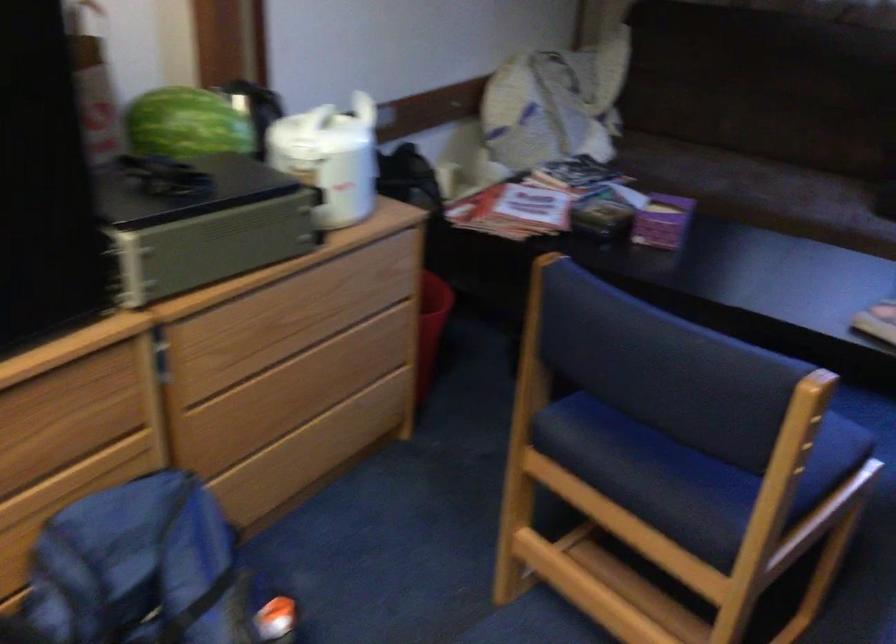
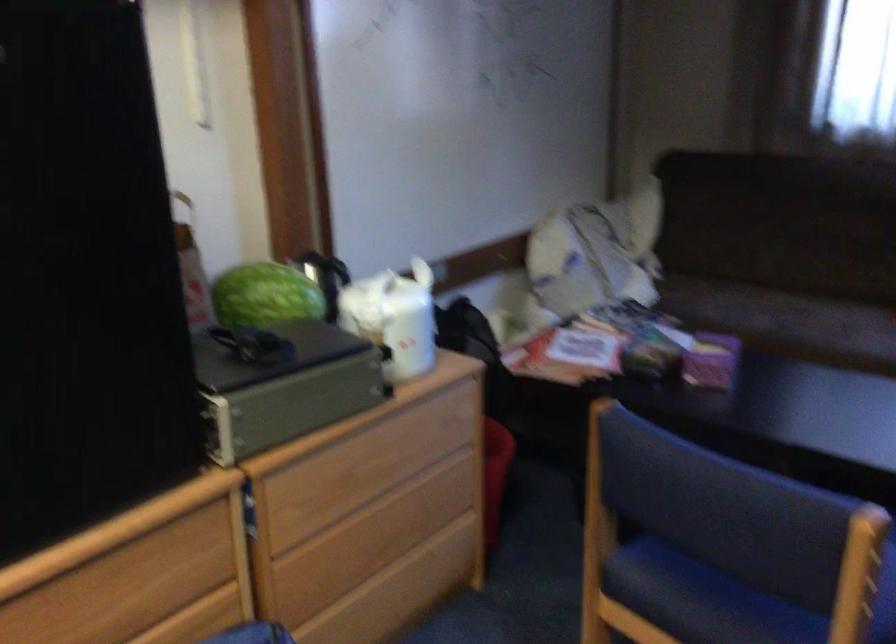
Find the pixel in the second image that matches (739,190) in the first image.

(787, 322)